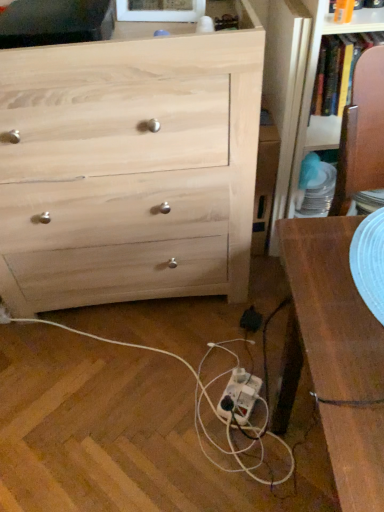
Question: From the image's perspective, is white plastic power strip at lower center located above or below natural wood chest of drawers at upper left?

Choices:
 (A) above
 (B) below

Answer: (B)

Question: Considering the positions of white plastic power strip at lower center and natural wood chest of drawers at upper left in the image, is white plastic power strip at lower center bigger or smaller than natural wood chest of drawers at upper left?

Choices:
 (A) small
 (B) big

Answer: (A)

Question: Which object is the closest to the natural wood chest of drawers at upper left?

Choices:
 (A) white plastic extension cord at lower center
 (B) white plastic power strip at lower center

Answer: (B)

Question: Which object is the closest to the natural wood chest of drawers at upper left?

Choices:
 (A) white plastic power strip at lower center
 (B) white plastic extension cord at lower center

Answer: (A)